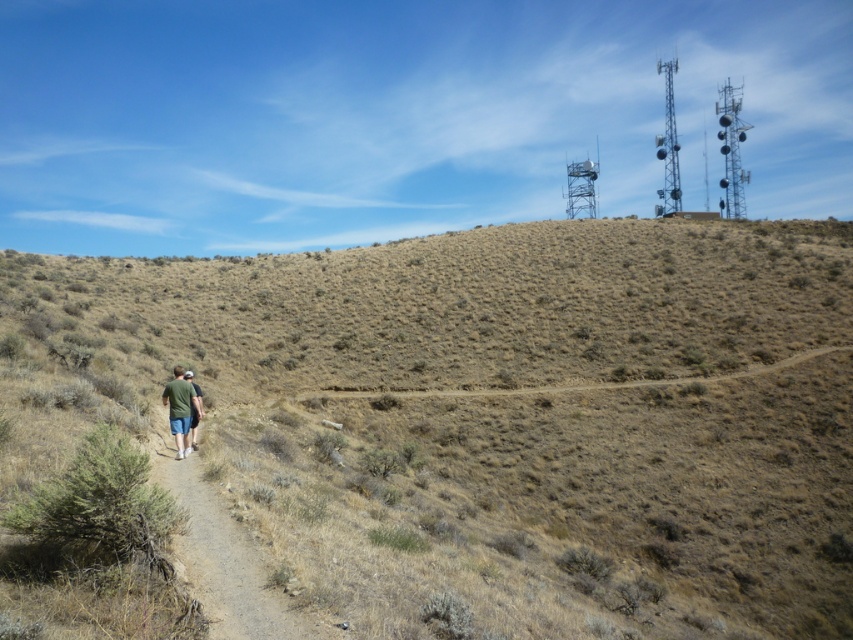
Between brown dry grass at center and dirt path at lower left, which one is positioned higher?

brown dry grass at center is above.

Which of these two, brown dry grass at center or dirt path at lower left, stands shorter?

Standing shorter between the two is dirt path at lower left.

Locate an element on the screen. The width and height of the screenshot is (853, 640). brown dry grass at center is located at coordinates (490, 417).

I want to click on brown dry grass at center, so click(490, 417).

Can you confirm if green fabric shorts at lower left is smaller than green fabric shirt at center?

Actually, green fabric shorts at lower left might be larger than green fabric shirt at center.

Describe the element at coordinates (180, 408) in the screenshot. I see `green fabric shorts at lower left` at that location.

Locate an element on the screen. This screenshot has height=640, width=853. green fabric shorts at lower left is located at coordinates (180, 408).

Between point (775, 387) and point (194, 392), which one is positioned behind?

Positioned behind is point (775, 387).

Identify the location of brown dry grass at center. The height and width of the screenshot is (640, 853). (490, 417).

Does point (721, 468) lie behind point (196, 387)?

Yes.

Find the location of `brown dry grass at center`. brown dry grass at center is located at coordinates (490, 417).